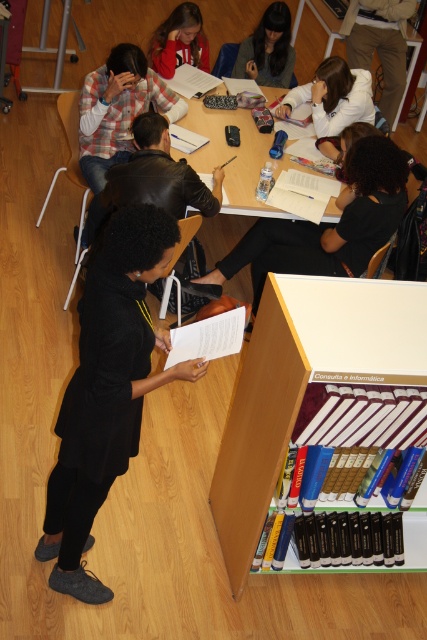
Question: Can you confirm if dark brown leather jacket at upper center is smaller than matte red hoodie at upper center?

Choices:
 (A) yes
 (B) no

Answer: (B)

Question: Does black matte dress at center have a smaller size compared to wooden table at center?

Choices:
 (A) yes
 (B) no

Answer: (A)

Question: Among these objects, which one is farthest from the camera?

Choices:
 (A) black matte shirt at center
 (B) black matte dress at center
 (C) matte gray sweater at upper center

Answer: (C)

Question: Which object is farther from the camera taking this photo?

Choices:
 (A) hardcover books at center
 (B) black matte dress at center
 (C) matte gray sweater at upper center
 (D) matte red hoodie at upper center

Answer: (C)

Question: Considering the real-world distances, which object is closest to the matte red hoodie at upper center?

Choices:
 (A) black matte dress at center
 (B) matte gray sweater at upper center
 (C) plaid fabric shirt at upper left
 (D) dark brown leather jacket at upper center

Answer: (B)

Question: Does black matte dress at center come in front of plaid fabric shirt at upper left?

Choices:
 (A) yes
 (B) no

Answer: (A)